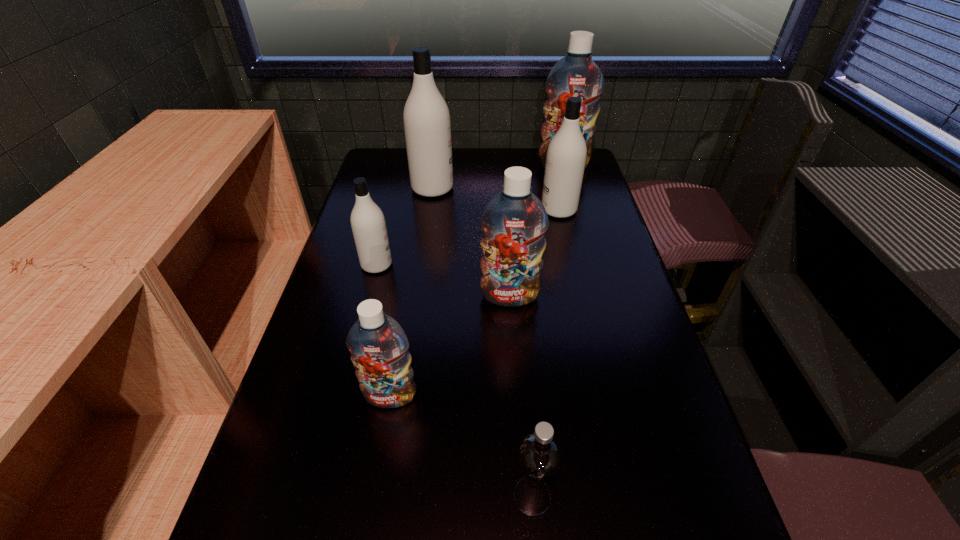
The height and width of the screenshot is (540, 960). What are the coordinates of `object situated at the left edge` in the screenshot? It's located at (368, 223).

What are the coordinates of `object located in the far right corner section of the desktop` in the screenshot? It's located at (575, 75).

This screenshot has height=540, width=960. I want to click on blank space at the far edge of the desktop, so click(472, 152).

The width and height of the screenshot is (960, 540). What are the coordinates of `vacant point at the right edge` in the screenshot? It's located at (621, 314).

At what (x,y) coordinates should I click in order to perform the action: click on vacant region at the far left corner of the desktop. Please return your answer as a coordinate pair (x, y). This screenshot has height=540, width=960. Looking at the image, I should click on (387, 150).

Where is `vacant space at the far right corner of the desktop`? The image size is (960, 540). vacant space at the far right corner of the desktop is located at coordinates (585, 177).

Locate an element on the screen. The width and height of the screenshot is (960, 540). unoccupied position between the vodka and the second biggest white shampoo is located at coordinates (545, 353).

This screenshot has width=960, height=540. Identify the location of free spot between the rightmost blue shampoo and the smallest white shampoo. (470, 215).

You are a GUI agent. You are given a task and a screenshot of the screen. Output one action in this format:
    pyautogui.click(x=<x>, y=<y>)
    Task: Click on the free spot between the second blue shampoo from left to right and the biggest white shampoo
    The width and height of the screenshot is (960, 540).
    Given the screenshot: What is the action you would take?
    pyautogui.click(x=471, y=242)

Locate an element on the screen. The width and height of the screenshot is (960, 540). vacant area that lies between the second biggest blue shampoo and the nearest object is located at coordinates (521, 396).